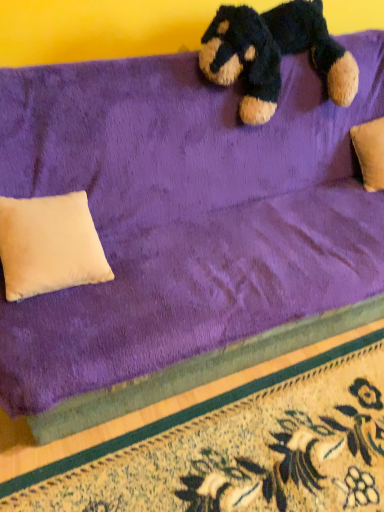
Question: From the image's perspective, is floral carpet at lower right beneath beige suede pillow at lower left?

Choices:
 (A) yes
 (B) no

Answer: (A)

Question: From a real-world perspective, is floral carpet at lower right physically below beige suede pillow at lower left?

Choices:
 (A) no
 (B) yes

Answer: (B)

Question: Is floral carpet at lower right not close to beige suede pillow at lower left?

Choices:
 (A) yes
 (B) no

Answer: (B)

Question: Considering the relative positions of floral carpet at lower right and beige suede pillow at lower left in the image provided, is floral carpet at lower right behind beige suede pillow at lower left?

Choices:
 (A) no
 (B) yes

Answer: (A)

Question: From a real-world perspective, is floral carpet at lower right physically above beige suede pillow at lower left?

Choices:
 (A) no
 (B) yes

Answer: (A)

Question: Considering the relative positions of beige suede pillow at lower left and velvety dark blue teddy bear at upper center in the image provided, is beige suede pillow at lower left to the left or to the right of velvety dark blue teddy bear at upper center?

Choices:
 (A) left
 (B) right

Answer: (A)

Question: Considering the positions of point (81, 203) and point (336, 99), is point (81, 203) closer or farther from the camera than point (336, 99)?

Choices:
 (A) farther
 (B) closer

Answer: (B)

Question: Is beige suede pillow at lower left spatially inside velvety dark blue teddy bear at upper center, or outside of it?

Choices:
 (A) outside
 (B) inside

Answer: (A)

Question: From a real-world perspective, is beige suede pillow at lower left physically located above or below velvety dark blue teddy bear at upper center?

Choices:
 (A) below
 (B) above

Answer: (A)

Question: Looking at the image, does floral carpet at lower right seem bigger or smaller compared to velvety dark blue teddy bear at upper center?

Choices:
 (A) small
 (B) big

Answer: (A)

Question: From a real-world perspective, relative to velvety dark blue teddy bear at upper center, is floral carpet at lower right vertically above or below?

Choices:
 (A) below
 (B) above

Answer: (A)

Question: Considering the positions of floral carpet at lower right and velvety dark blue teddy bear at upper center in the image, is floral carpet at lower right taller or shorter than velvety dark blue teddy bear at upper center?

Choices:
 (A) short
 (B) tall

Answer: (A)

Question: Based on their positions, is floral carpet at lower right located to the left or right of velvety dark blue teddy bear at upper center?

Choices:
 (A) right
 (B) left

Answer: (B)

Question: Is floral carpet at lower right spatially inside beige suede pillow at lower left, or outside of it?

Choices:
 (A) inside
 (B) outside

Answer: (B)

Question: Considering their positions, is floral carpet at lower right located in front of or behind beige suede pillow at lower left?

Choices:
 (A) behind
 (B) front

Answer: (B)